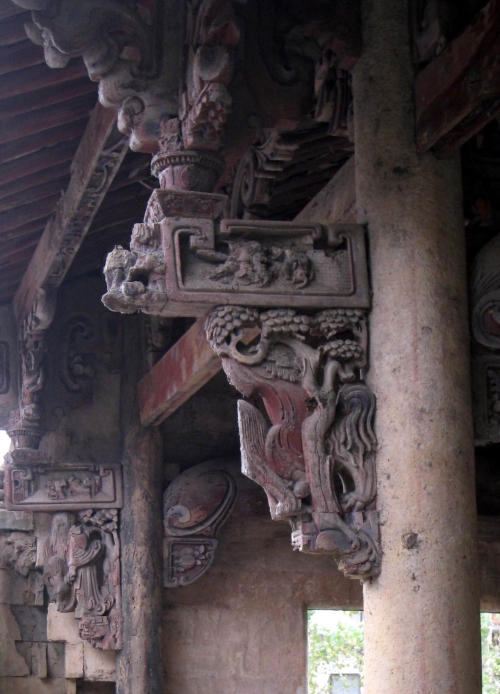
At what (x,y) coordinates should I click in order to perform the action: click on ceiling. Please return your answer as a coordinate pair (x, y). This screenshot has width=500, height=694. Looking at the image, I should click on (38, 191).